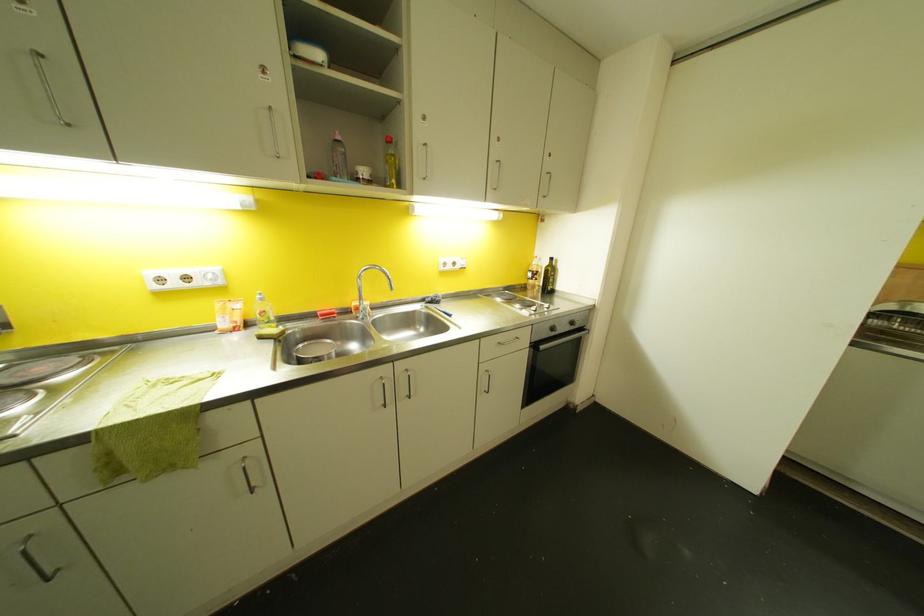
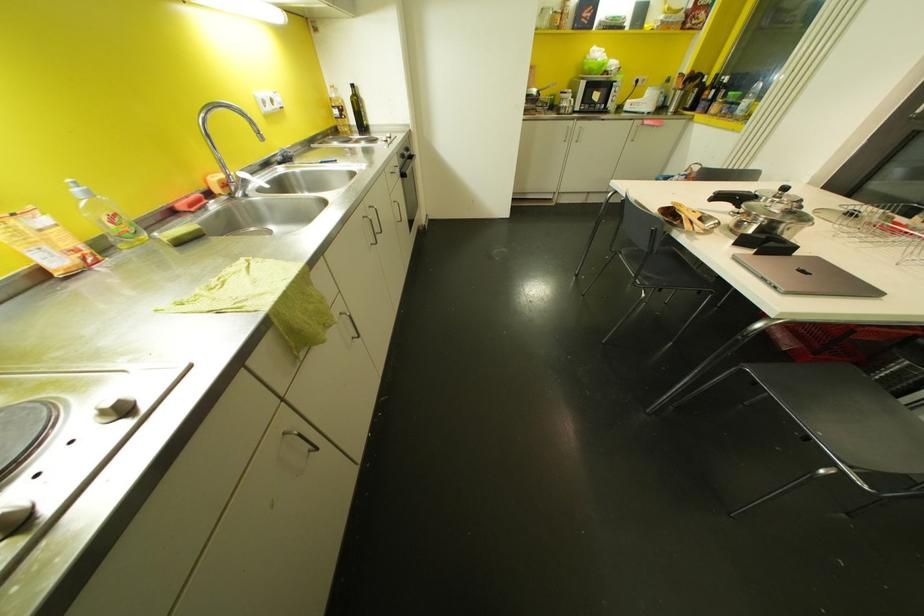
Where in the second image is the point corresponding to [551,259] from the first image?

(353, 84)